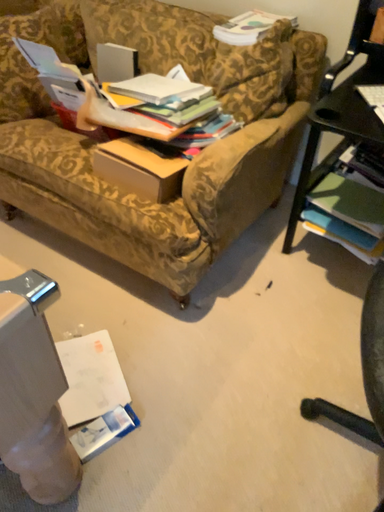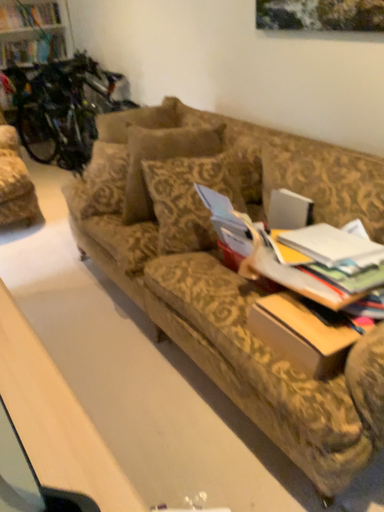
Question: How did the camera likely rotate when shooting the video?

Choices:
 (A) rotated right
 (B) rotated left

Answer: (B)